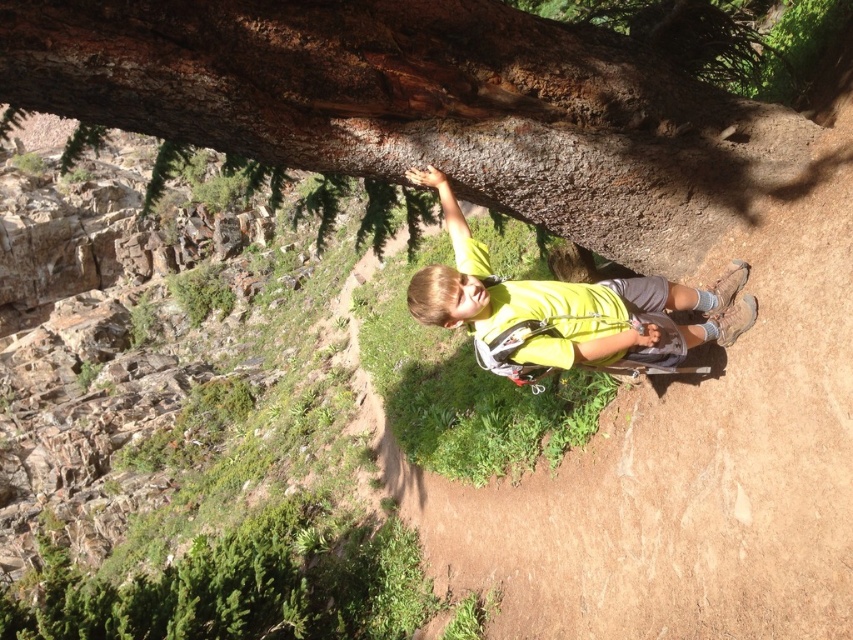
The boy is wearing a yellow fabric shirt at center and leaning against a smooth brown bark at upper center. Which object takes up more space in the image?

The smooth brown bark at upper center takes up more space in the image because it is bigger than the yellow fabric shirt at center.

You are a photographer trying to capture a closeup of the smooth brown bark at upper center while also including the yellow fabric shirt at center in the frame. Given that your camera has a maximum focus range of 30 inches, will you be able to capture both subjects in focus?

The smooth brown bark at upper center is 29.24 inches from the yellow fabric shirt at center. Since the distance between them is within the camera maximum focus range of 30 inches, both subjects can be captured in focus.